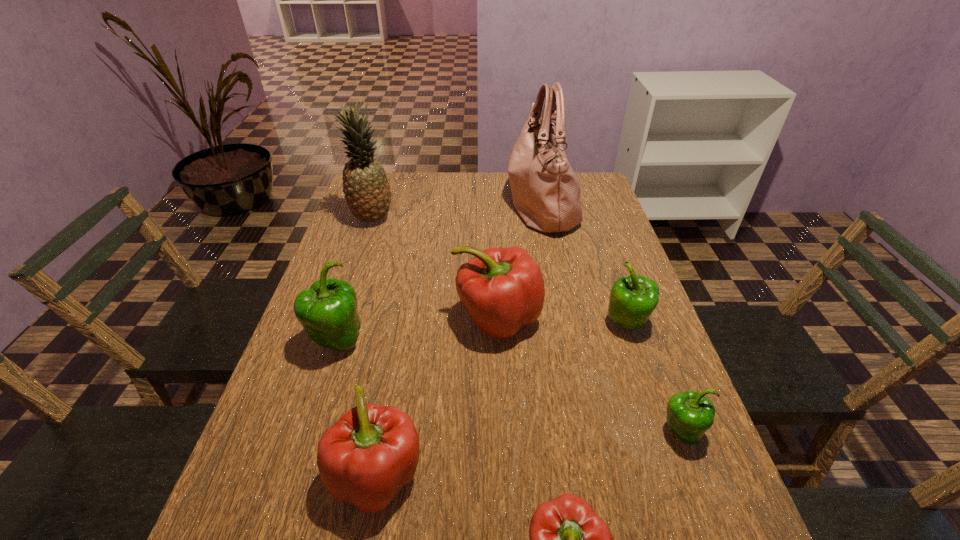
Image resolution: width=960 pixels, height=540 pixels. I want to click on handbag, so click(x=546, y=193).

The image size is (960, 540). Identify the location of pineapple. (367, 191).

The image size is (960, 540). In order to click on the biggest green bell pepper in this screenshot , I will do coord(327,311).

Identify the location of the farthest pink bell pepper. (502, 289).

What are the coordinates of `the second smallest green bell pepper` in the screenshot? It's located at point(633,299).

Locate an element on the screen. the leftmost pink bell pepper is located at coordinates (372, 451).

Locate an element on the screen. Image resolution: width=960 pixels, height=540 pixels. the nearest green bell pepper is located at coordinates (690, 414).

Locate an element on the screen. The height and width of the screenshot is (540, 960). vacant point located 0.070m at the front of the handbag with handles is located at coordinates (486, 202).

This screenshot has width=960, height=540. I want to click on vacant space located at the front of the handbag with handles, so click(431, 202).

This screenshot has height=540, width=960. What are the coordinates of `vacant region located at the front of the handbag with handles` in the screenshot? It's located at click(x=394, y=202).